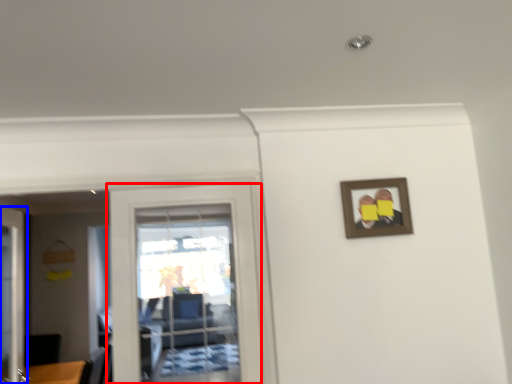
Question: Which object appears farthest to the camera in this image, door (highlighted by a red box) or door (highlighted by a blue box)?

Choices:
 (A) door
 (B) door

Answer: (B)